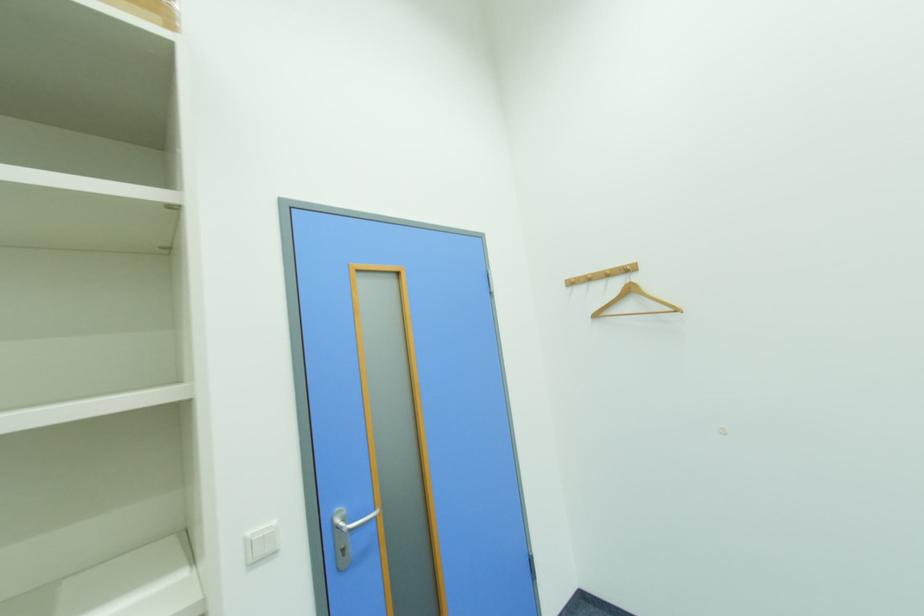
The height and width of the screenshot is (616, 924). In order to click on metal door handle in this screenshot , I will do `click(346, 536)`.